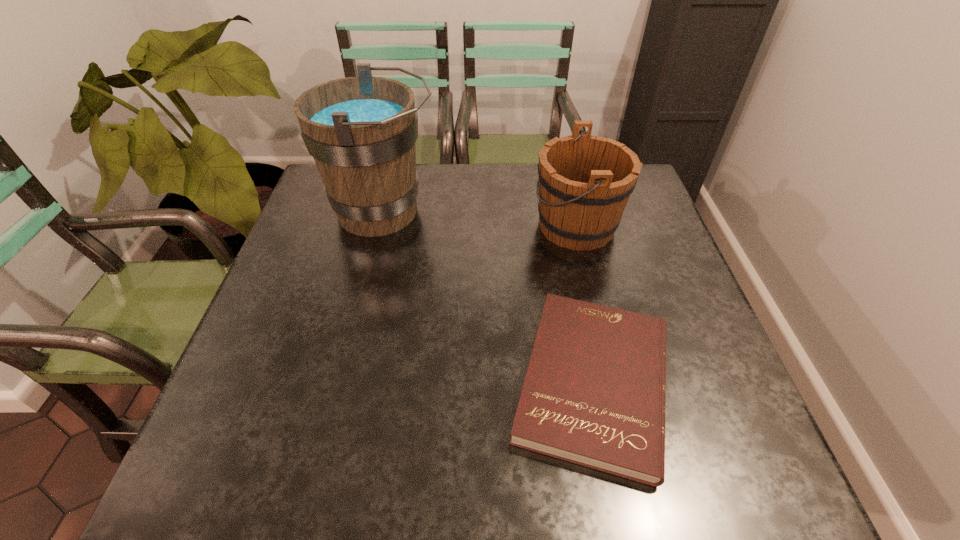
Identify the location of free location at the left edge of the desktop. Image resolution: width=960 pixels, height=540 pixels. (329, 276).

Find the location of `vacant region at the right edge of the desktop`. vacant region at the right edge of the desktop is located at coordinates (672, 340).

Image resolution: width=960 pixels, height=540 pixels. In order to click on empty location between the second shortest object and the tallest object in this screenshot , I will do `click(480, 219)`.

At what (x,y) coordinates should I click in order to perform the action: click on vacant space that is in between the left wine bucket and the nearest object. Please return your answer as a coordinate pair (x, y). Looking at the image, I should click on (489, 297).

Locate an element on the screen. The width and height of the screenshot is (960, 540). free area in between the left wine bucket and the second shortest object is located at coordinates (480, 219).

The height and width of the screenshot is (540, 960). I want to click on free space between the shorter wine bucket and the left wine bucket, so pyautogui.click(x=480, y=219).

I want to click on free space that is in between the left wine bucket and the hardback book, so pyautogui.click(x=489, y=297).

Find the location of a particular element. free space that is in between the second tallest object and the taller wine bucket is located at coordinates 480,219.

I want to click on free space that is in between the nearest object and the left wine bucket, so click(489, 297).

Identify the location of the closest object to the nearest object. The width and height of the screenshot is (960, 540). (585, 181).